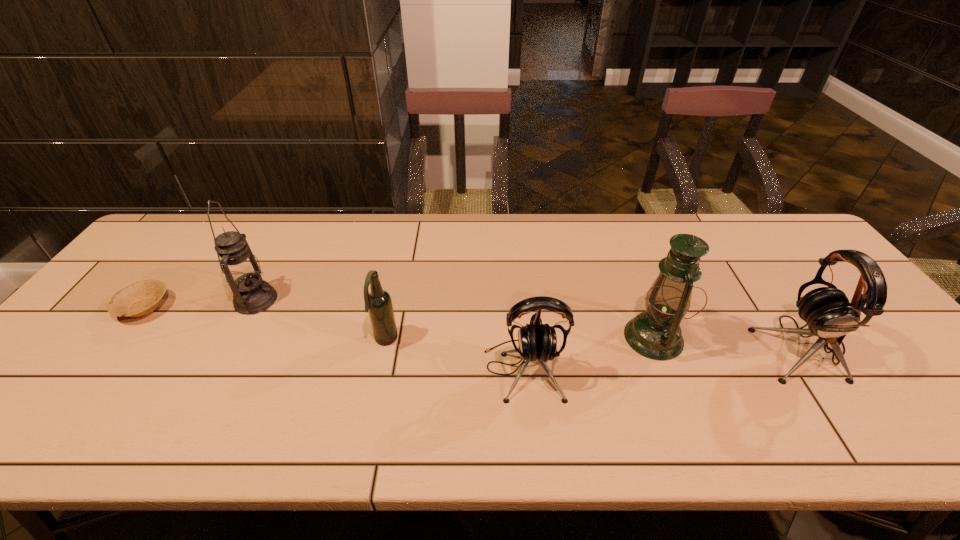
You are a GUI agent. You are given a task and a screenshot of the screen. Output one action in this format:
    pyautogui.click(x=<x>, y=<y>)
    Task: Click on the vacant point located on the left of the taller earphone
    The height and width of the screenshot is (540, 960).
    Given the screenshot: What is the action you would take?
    701,347

At what (x,y) coordinates should I click in order to perform the action: click on vacant space located 0.080m on the right of the leftmost object. Please return your answer as a coordinate pair (x, y). Looking at the image, I should click on (199, 307).

This screenshot has width=960, height=540. Find the location of `free space located on the right of the left oil lamp`. free space located on the right of the left oil lamp is located at coordinates (360, 300).

Identify the location of vacant space situated 0.210m on the back of the third object from left to right. The width and height of the screenshot is (960, 540). (399, 274).

The height and width of the screenshot is (540, 960). I want to click on vacant space located on the right of the right oil lamp, so click(790, 338).

Identify the location of object present at the left edge. (141, 298).

Where is `object at the right edge`? object at the right edge is located at coordinates (826, 310).

The image size is (960, 540). In order to click on object positioned at the near right corner in this screenshot , I will do `click(826, 310)`.

Identify the location of free space at the far edge of the desktop. (642, 253).

The width and height of the screenshot is (960, 540). In order to click on vacant space at the near edge of the desktop in this screenshot , I will do `click(230, 396)`.